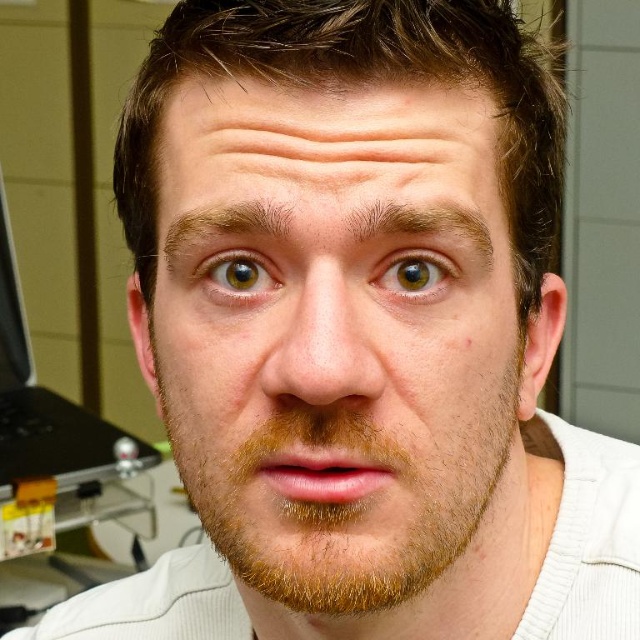
You are a photographer standing 12 inches away from a subject. You want to take a closeup portrait of the smooth skin face at center. Is the subject currently within the recommended 10 inch distance for optimal focus?

The smooth skin face at center is 10.10 inches away from the viewer, which is just slightly beyond the recommended 10 inch distance for optimal focus. Adjusting to be 0.10 inches closer would ensure better focus.